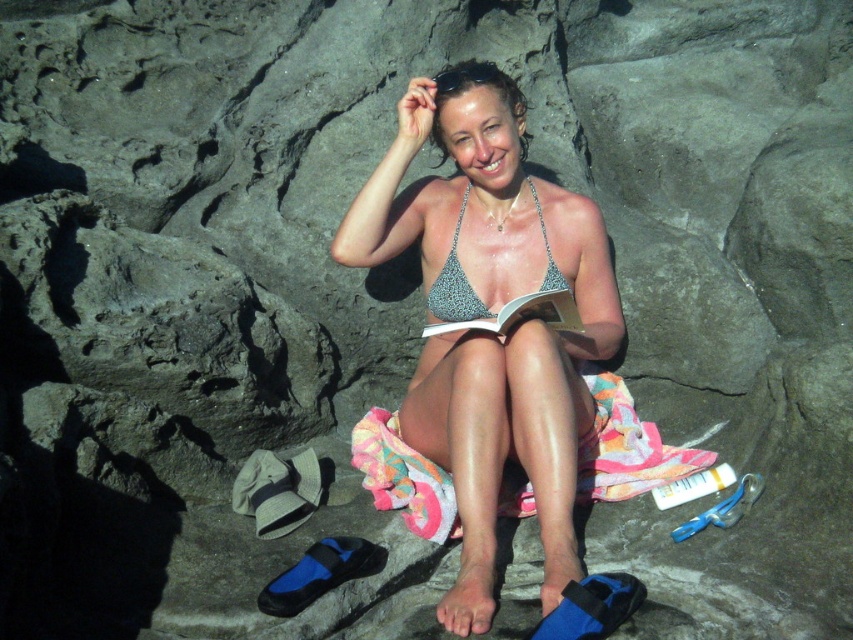
You are a photographer trying to capture the woman in the scene. You need to ensure both the metallic bikini top at center and the sparkly silver bikini top at center are clearly visible in the photo. Given that your camera has a minimum focus distance of 6 inches, will you be able to capture both items in focus without moving the camera closer?

The distance between the metallic bikini top at center and the sparkly silver bikini top at center is 5.87 inches. Since the minimum focus distance of the camera is 6 inches, the camera cannot capture both items in focus without moving closer because the required distance is slightly less than the camera can handle.

You are a photographer trying to capture the woman in the scene. You need to ensure both the metallic bikini top at center and the sparkly silver bikini top at center are clearly visible in your shot. Which bikini top should you focus on to ensure it doesn not get obscured by the other?

The metallic bikini top at center might be wider than the sparkly silver bikini top at center, so focusing on the metallic bikini top at center would help prevent it from overlapping or obscuring the sparkly silver bikini top at center.